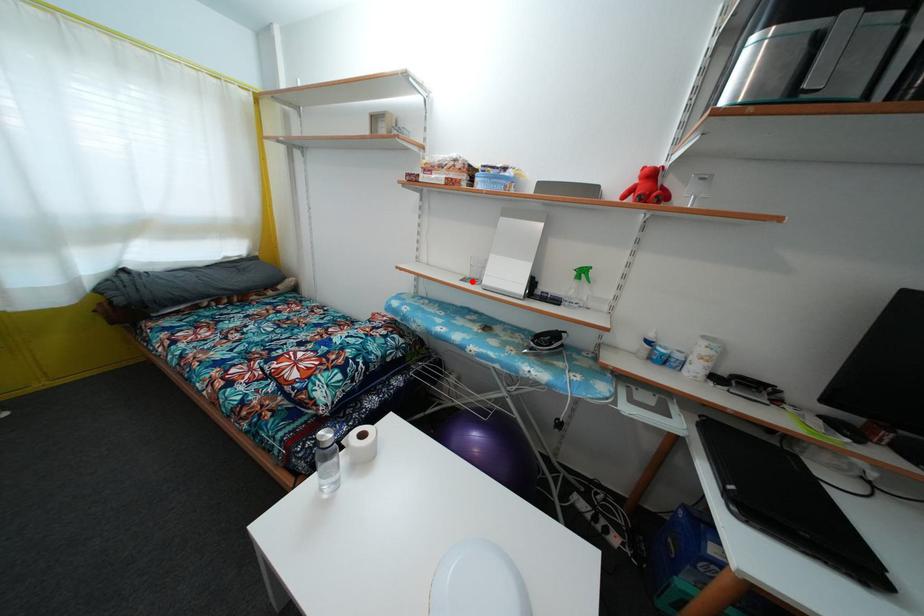
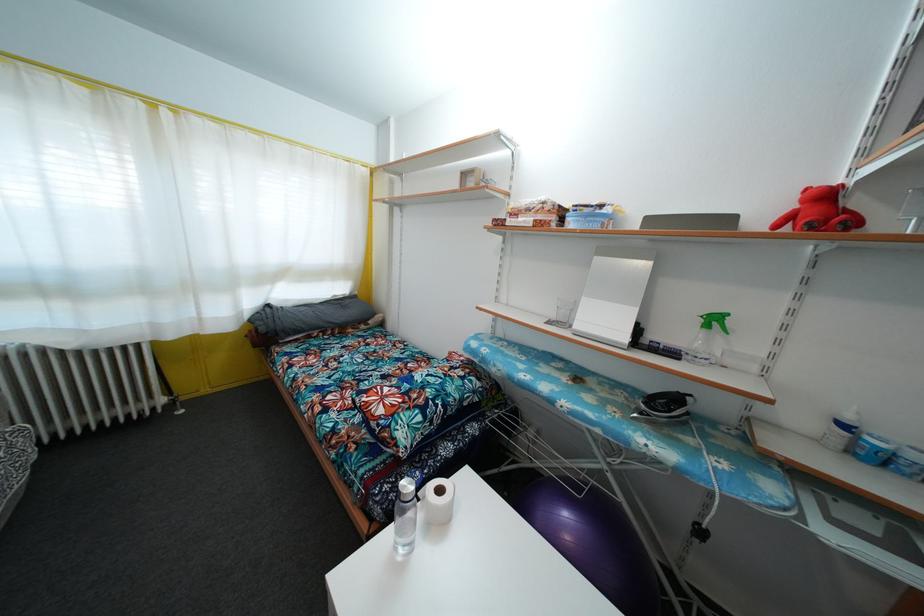
The point at the highlighted location is marked in the first image. Where is the corresponding point in the second image?

(556, 323)